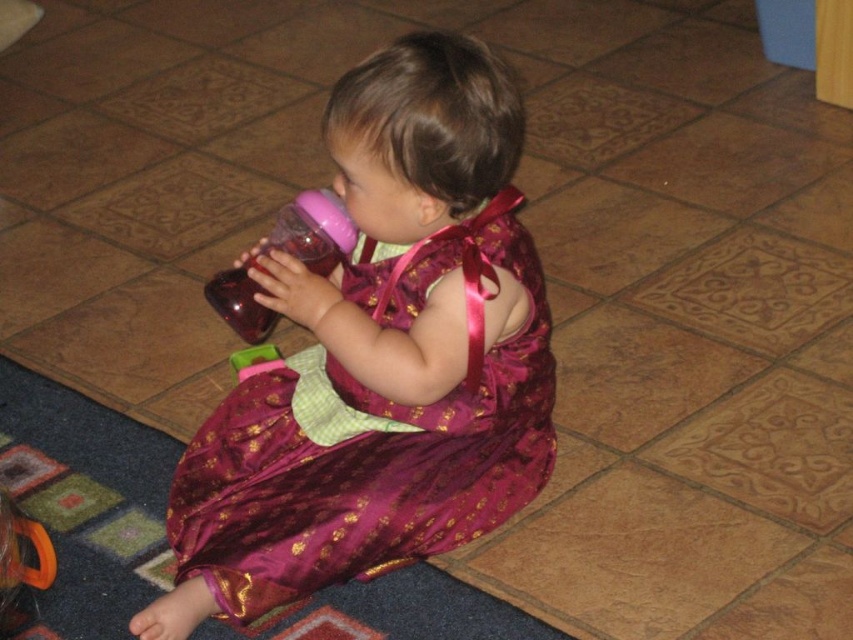
Between shiny purple dress at center and pink plastic bottle at center, which one appears on the left side from the viewer's perspective?

pink plastic bottle at center is more to the left.

Does shiny purple dress at center have a greater height compared to pink plastic bottle at center?

Yes.

Who is more distant from viewer, (267, 604) or (309, 221)?

The point (309, 221) is more distant.

At what (x,y) coordinates should I click in order to perform the action: click on shiny purple dress at center. Please return your answer as a coordinate pair (x, y). Looking at the image, I should click on (372, 436).